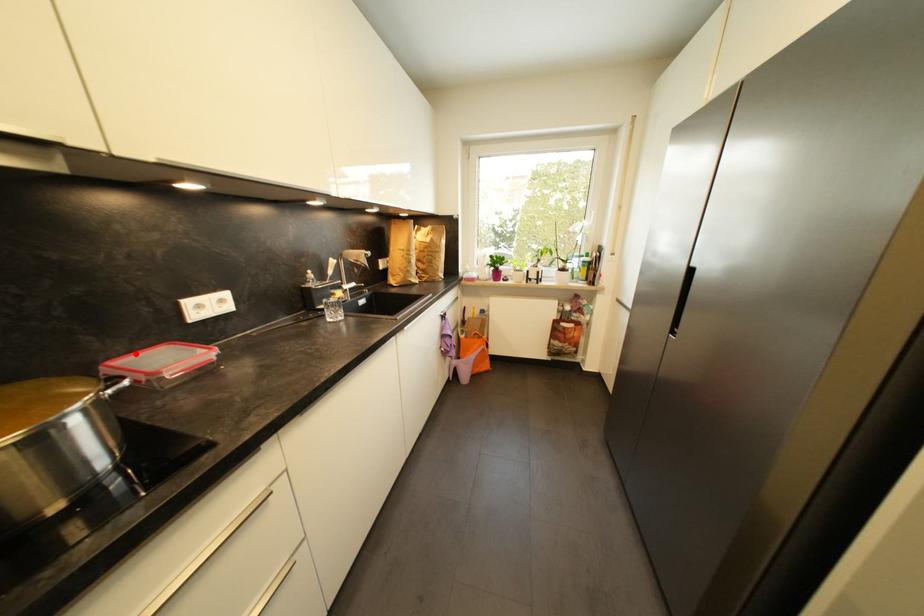
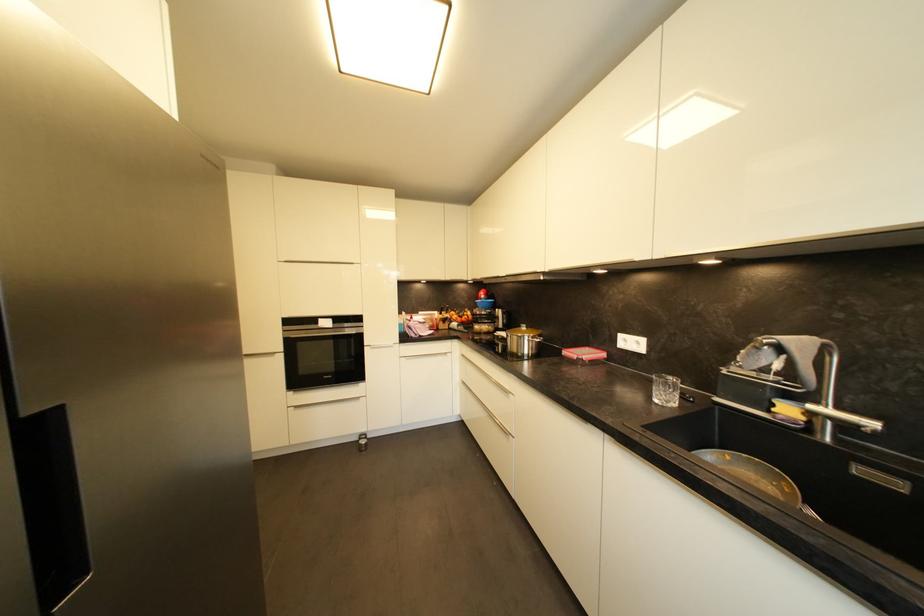
The point at the highlighted location is marked in the first image. Where is the corresponding point in the second image?

(602, 350)